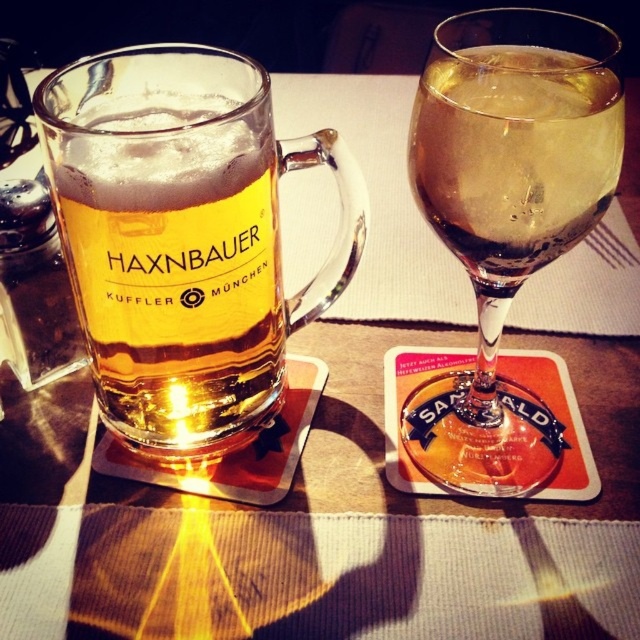
Between point (588, 72) and point (564, 138), which one is positioned behind?

Positioned behind is point (588, 72).

Is the position of clear glass wine at right more distant than that of translucent glass at upper right?

No, it is not.

This screenshot has width=640, height=640. In order to click on clear glass wine at right in this screenshot , I will do coord(506,216).

This screenshot has height=640, width=640. Describe the element at coordinates (176, 268) in the screenshot. I see `golden glass beer mug at left` at that location.

Can you confirm if golden glass beer mug at left is taller than translucent glass at upper right?

Correct, golden glass beer mug at left is much taller as translucent glass at upper right.

Between point (224, 236) and point (499, 252), which one is positioned in front?

Point (499, 252)

Locate an element on the screen. This screenshot has height=640, width=640. golden glass beer mug at left is located at coordinates (176, 268).

Does clear glass wine at right appear under golden glass beer mug at left?

No, clear glass wine at right is not below golden glass beer mug at left.

Between point (579, 216) and point (122, 401), which one is positioned behind?

The point (122, 401) is more distant.

Identify the location of clear glass wine at right. The width and height of the screenshot is (640, 640). (506, 216).

This screenshot has height=640, width=640. I want to click on clear glass wine at right, so click(x=506, y=216).